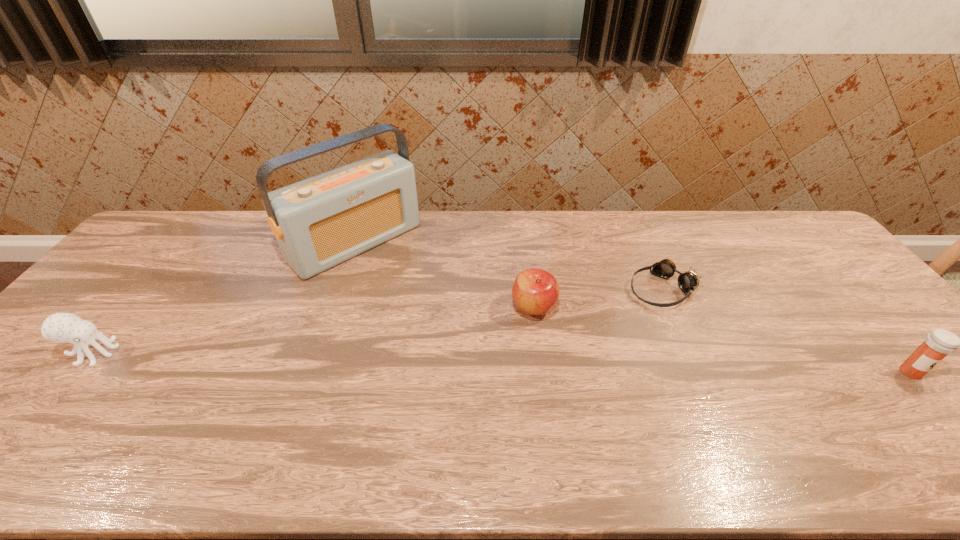
Where is `vacant space on the desktop that is between the octopus and the medicine and is positioned on the stem of the apple`? vacant space on the desktop that is between the octopus and the medicine and is positioned on the stem of the apple is located at coordinates (567, 364).

The width and height of the screenshot is (960, 540). I want to click on free space on the desktop that is between the octopus and the rightmost object and is positioned through the lenses of the second object from right to left, so click(x=556, y=363).

Where is `free spot on the desktop that is between the octopus and the rightmost object and is positioned on the front-facing side of the radio receiver`? The height and width of the screenshot is (540, 960). free spot on the desktop that is between the octopus and the rightmost object and is positioned on the front-facing side of the radio receiver is located at coordinates pos(491,362).